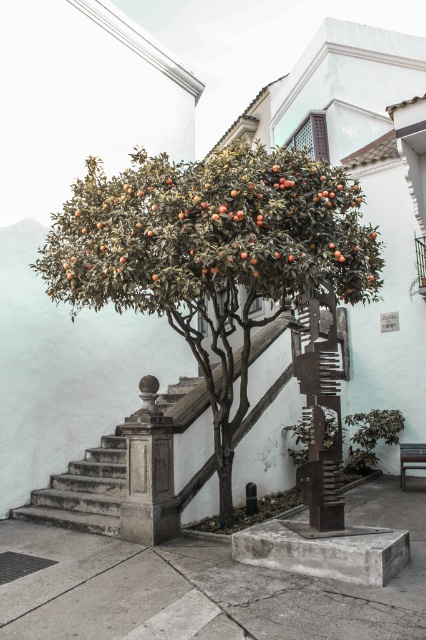
You are standing at the bottom of the gray concrete stairs at center and want to walk up them while keeping the green leafy tree at center on your left side. Is this possible?

The green leafy tree at center is positioned on the right side of gray concrete stairs at center, so if you stand at the bottom of the gray concrete stairs at center and walk up while facing the stairs, the tree will be on your right side. To have the tree on your left, you would need to turn around and walk backwards, which is not practical. Therefore, it is not possible to walk up the stairs while keeping the green leafy tree at center on your left side.